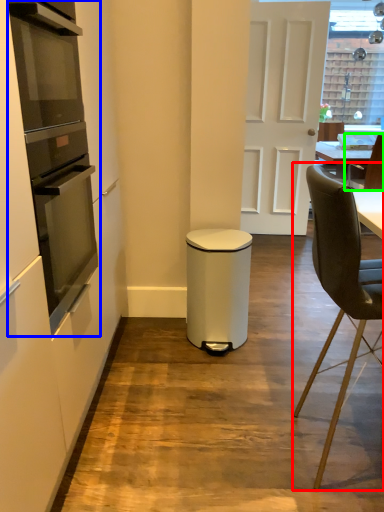
Question: Considering the real-world distances, which object is farthest from chair (highlighted by a red box)? kitchen appliance (highlighted by a blue box) or chair (highlighted by a green box)?

Choices:
 (A) kitchen appliance
 (B) chair

Answer: (B)